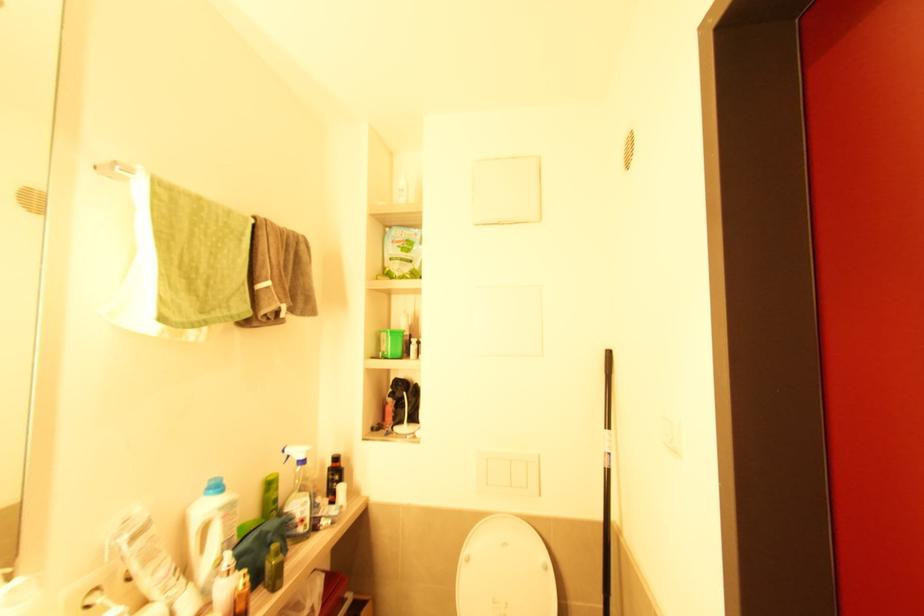
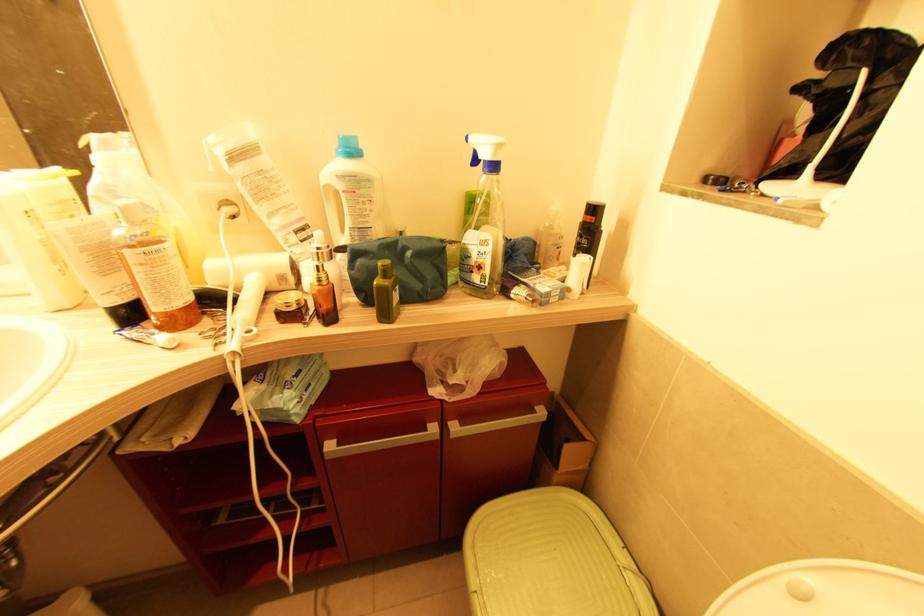
Where in the second image is the point corresponding to the point at 298,527 from the first image?

(473, 273)